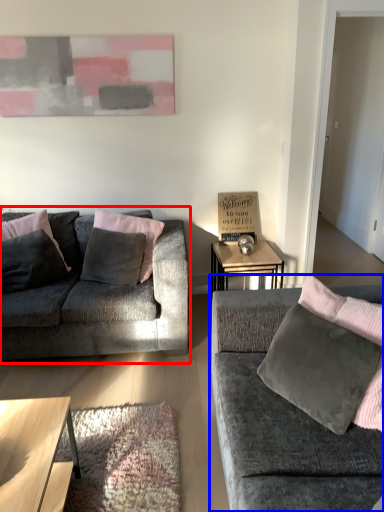
Question: Which point is closer to the camera, studio couch (highlighted by a red box) or studio couch (highlighted by a blue box)?

Choices:
 (A) studio couch
 (B) studio couch

Answer: (B)